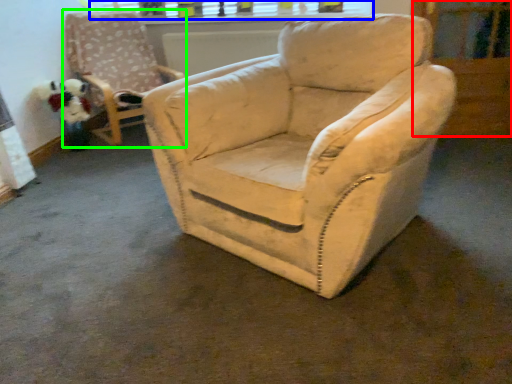
Question: Estimate the real-world distances between objects in this image. Which object is farther from screen door (highlighted by a red box), window frame (highlighted by a blue box) or chair (highlighted by a green box)?

Choices:
 (A) window frame
 (B) chair

Answer: (B)